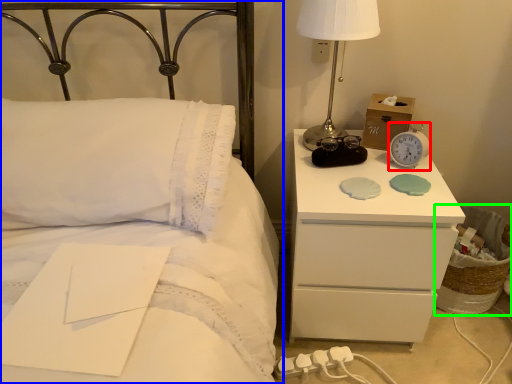
Question: Which is farther away from alarm clock (highlighted by a red box)? bed (highlighted by a blue box) or basket (highlighted by a green box)?

Choices:
 (A) bed
 (B) basket

Answer: (A)